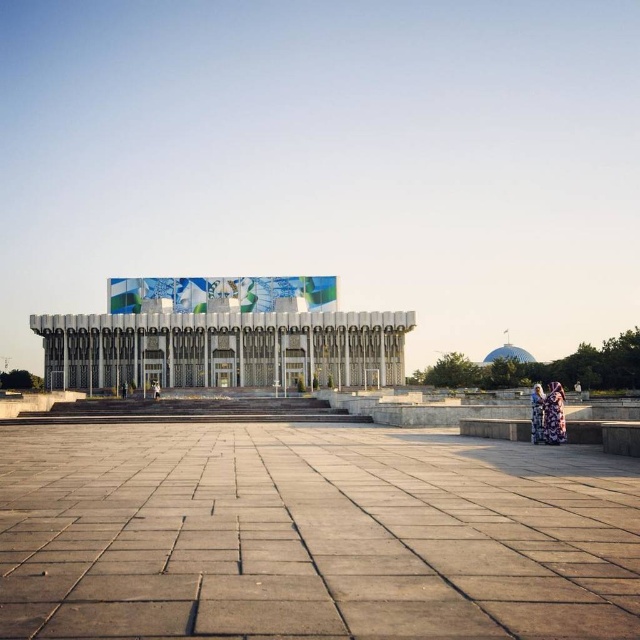
Is white glossy building at center taller than floral dress at lower right?

Yes, white glossy building at center is taller than floral dress at lower right.

Is white glossy building at center closer to camera compared to floral dress at lower right?

No, white glossy building at center is further to the viewer.

What do you see at coordinates (221, 337) in the screenshot? This screenshot has width=640, height=640. I see `white glossy building at center` at bounding box center [221, 337].

Identify the location of white glossy building at center. (221, 337).

Looking at this image, is white glossy building at center to the right of printed fabric person at lower right from the viewer's perspective?

Incorrect, white glossy building at center is not on the right side of printed fabric person at lower right.

Who is shorter, white glossy building at center or printed fabric person at lower right?

With less height is printed fabric person at lower right.

Find the location of a particular element. The height and width of the screenshot is (640, 640). white glossy building at center is located at coordinates (221, 337).

What are the coordinates of `gray concrete plaza at center` in the screenshot? It's located at (310, 534).

The width and height of the screenshot is (640, 640). What do you see at coordinates (310, 534) in the screenshot?
I see `gray concrete plaza at center` at bounding box center [310, 534].

Find the location of a particular element. The image size is (640, 640). gray concrete plaza at center is located at coordinates (310, 534).